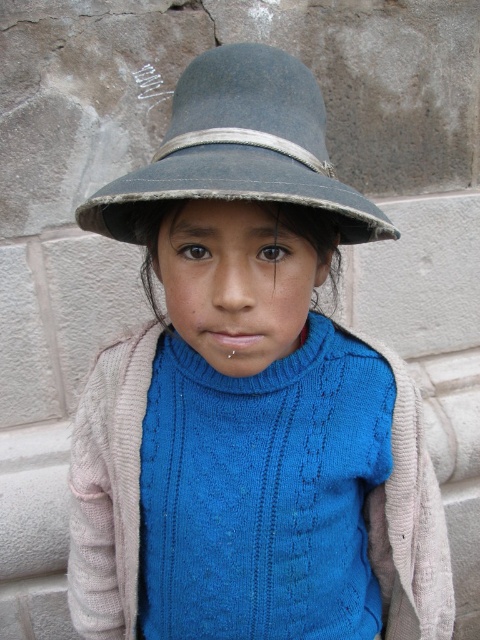
You are a tailor trying to adjust the size of the worn blue fabric hat at upper center so it fits perfectly over the blue knitted sweater at center. Given their proximity, is the current distance between them sufficient for the hat to comfortably sit on the sweater without overlapping?

The worn blue fabric hat at upper center is only 3.00 inches away from the blue knitted sweater at center. This distance may be sufficient for the hat to sit comfortably on the sweater without overlapping, as 3 inches provides enough space for proper placement.

The child is wearing a worn blue fabric hat at upper center and a blue knitted sweater at center. Which item of clothing is bigger in size?

The worn blue fabric hat at upper center is larger in size than the blue knitted sweater at center.